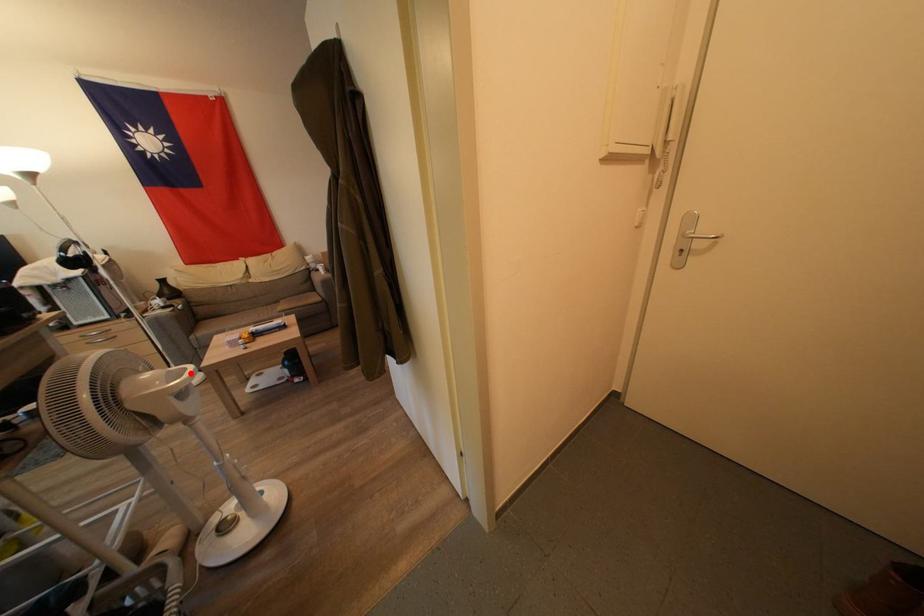
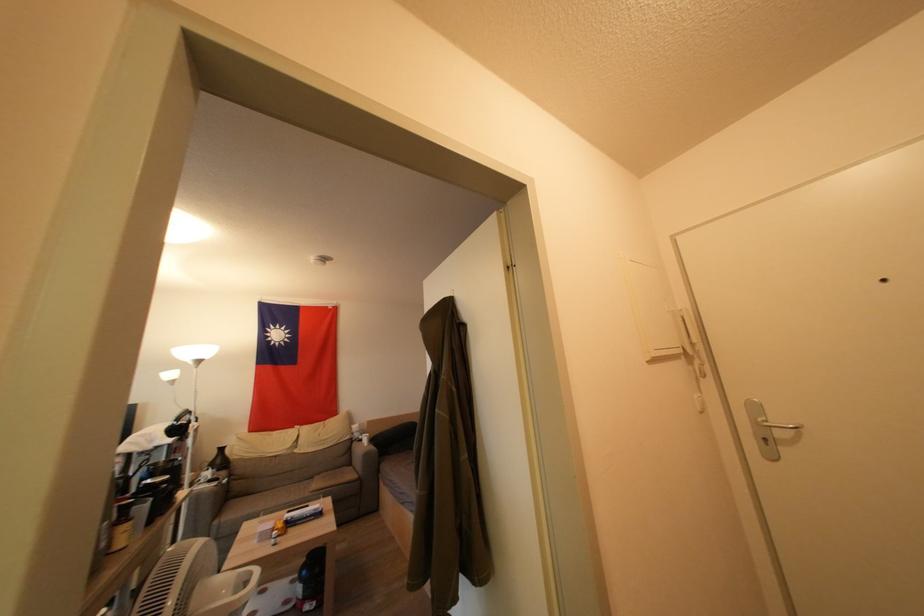
Find the pixel in the second image that matches the highlighted location in the first image.

(256, 577)